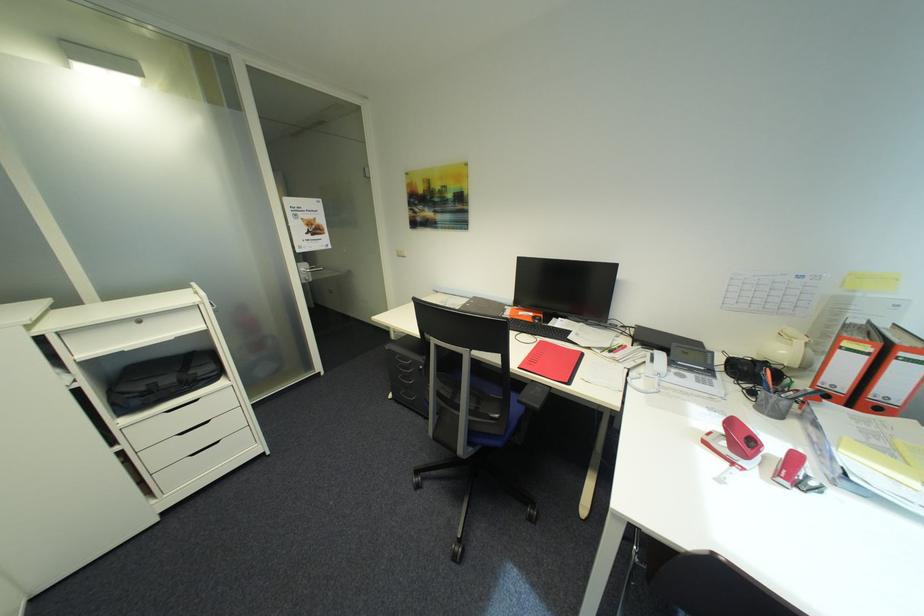
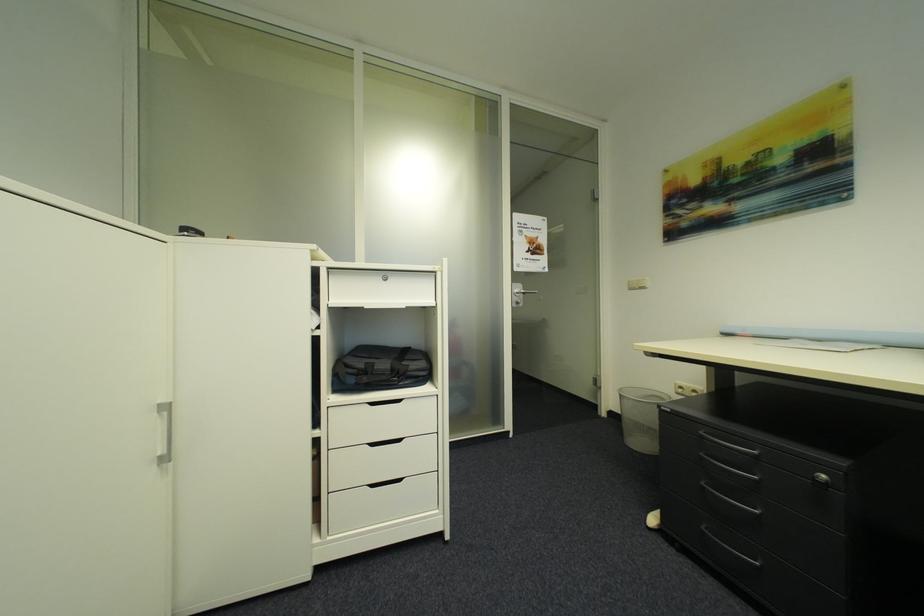
Looking at this image, the images are taken continuously from a first-person perspective. In which direction is your viewpoint rotating?

The rotation direction of the camera is left-up.